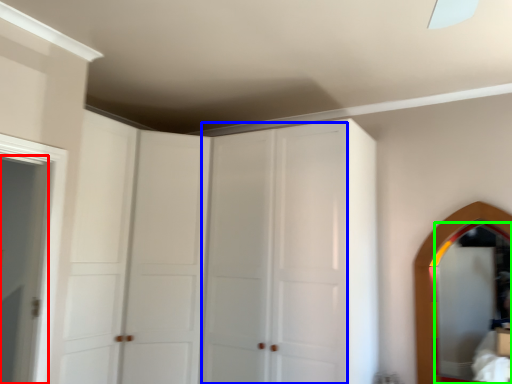
Question: Estimate the real-world distances between objects in this image. Which object is farther from door (highlighted by a red box), glass door (highlighted by a blue box) or mirror (highlighted by a green box)?

Choices:
 (A) glass door
 (B) mirror

Answer: (B)